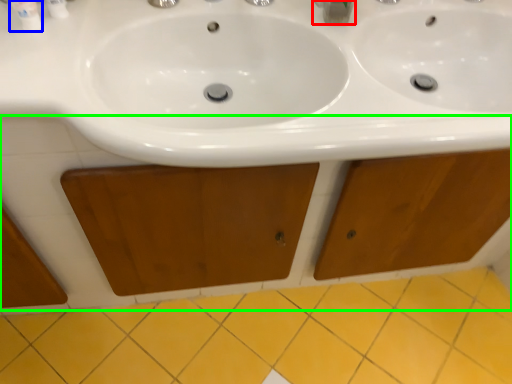
Question: Which is nearer to the plumbing fixture (highlighted by a red box)? mouthwash (highlighted by a blue box) or cabinetry (highlighted by a green box).

Choices:
 (A) mouthwash
 (B) cabinetry

Answer: (A)